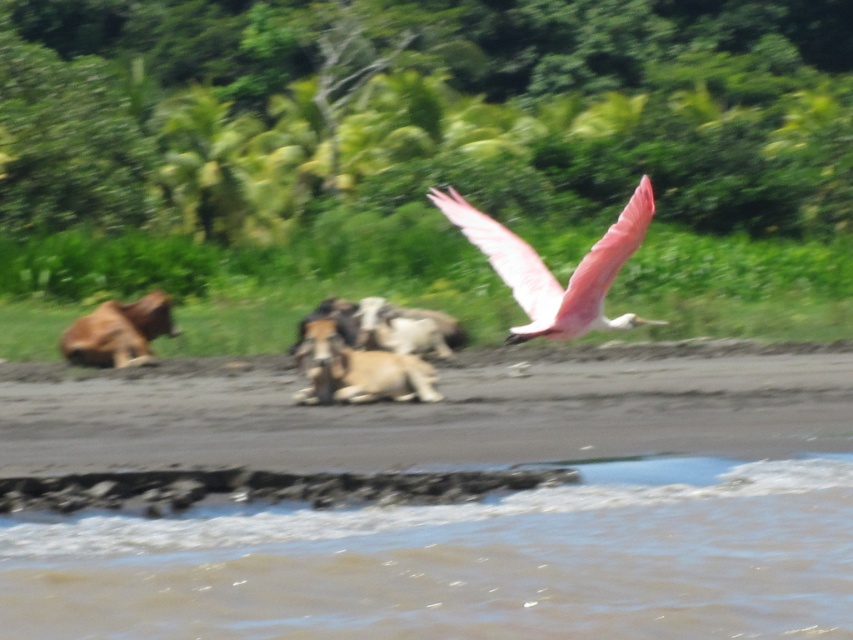
Question: Considering the relative positions of brown fur at center and brown fur dog at left in the image provided, where is brown fur at center located with respect to brown fur dog at left?

Choices:
 (A) right
 (B) left

Answer: (A)

Question: Which of the following is the farthest from the observer?

Choices:
 (A) brown fur dog at left
 (B) brown muddy water at lower center

Answer: (A)

Question: Is pink feathered bird at upper right closer to camera compared to brown fur at center?

Choices:
 (A) no
 (B) yes

Answer: (B)

Question: Which object is positioned closest to the brown fur at center?

Choices:
 (A) pink feathered bird at upper right
 (B) brown fur dog at left
 (C) brown muddy water at lower center
 (D) white woolen goat at center

Answer: (D)

Question: Which object appears farthest from the camera in this image?

Choices:
 (A) pink feathered bird at upper right
 (B) brown fur at center
 (C) brown fur dog at left

Answer: (C)

Question: Can you confirm if brown fur at center is positioned to the right of brown fur dog at left?

Choices:
 (A) no
 (B) yes

Answer: (B)